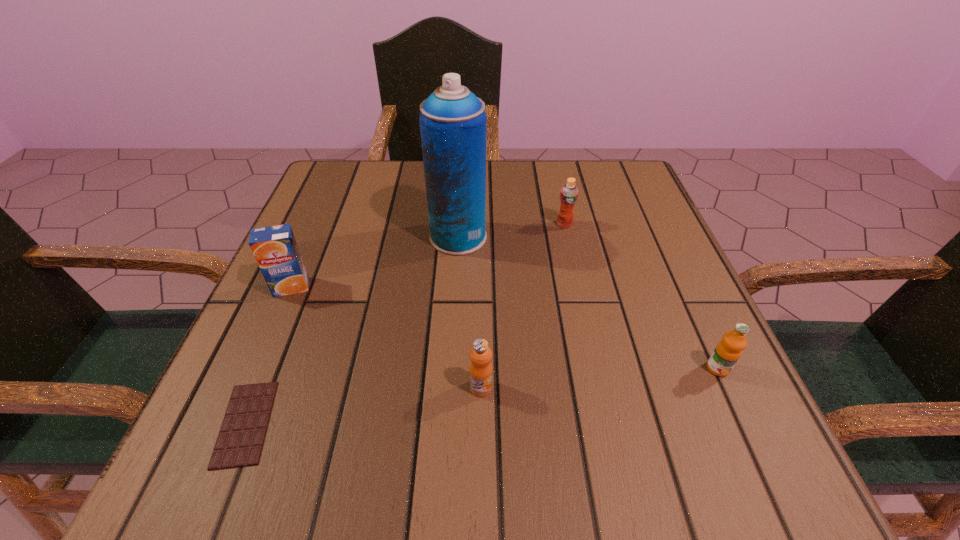
Find the location of a particular element. The image size is (960, 540). free space between the tallest object and the second orange juice from left to right is located at coordinates (469, 312).

You are a GUI agent. You are given a task and a screenshot of the screen. Output one action in this format:
    pyautogui.click(x=<x>, y=<y>)
    Task: Click on the free space between the third orange juice from left to right and the nearest orange juice
    This screenshot has width=960, height=540.
    Given the screenshot: What is the action you would take?
    pyautogui.click(x=522, y=306)

Locate an element on the screen. The height and width of the screenshot is (540, 960). empty space that is in between the farthest orange juice and the aerosol can is located at coordinates (512, 231).

Locate an element on the screen. This screenshot has height=540, width=960. free spot between the third farthest orange juice and the third orange juice from right to left is located at coordinates (599, 378).

I want to click on free space between the chocolate bar and the tallest object, so click(x=352, y=330).

This screenshot has width=960, height=540. In order to click on unoccupied area between the tallest object and the rightmost orange juice in this screenshot , I will do `click(588, 303)`.

Find the location of a particular element. object that can be found as the fourth closest to the tallest object is located at coordinates [240, 440].

The height and width of the screenshot is (540, 960). Find the location of `object identified as the closest to the chocolate bar`. object identified as the closest to the chocolate bar is located at coordinates (275, 249).

Locate which orange juice ranks in proximity to the third farthest orange juice. Please provide its 2D coordinates. Your answer should be formatted as a tuple, i.e. [(x, y)], where the tuple contains the x and y coordinates of a point satisfying the conditions above.

[(480, 370)]

Locate which orange juice ranks fourth in proximity to the tallest object. Please provide its 2D coordinates. Your answer should be formatted as a tuple, i.e. [(x, y)], where the tuple contains the x and y coordinates of a point satisfying the conditions above.

[(727, 352)]